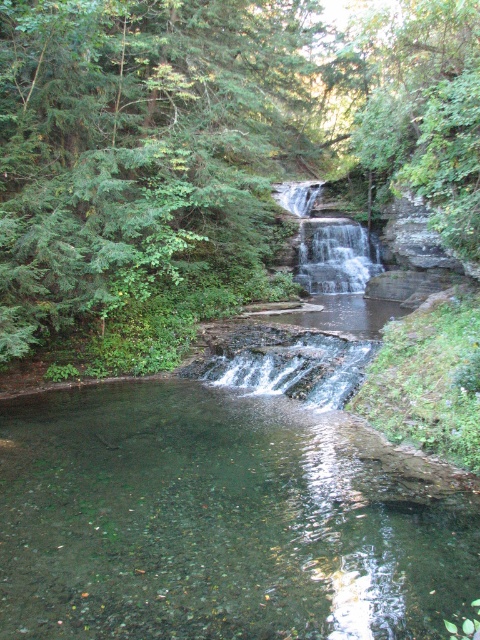
You are a hiker who wants to cross the clear water at center. There is a green leafy tree at center nearby. Can you use the tree to help you cross the water safely?

The green leafy tree at center is 15.76 feet away from the clear water at center. Since the distance is too far to jump across, you may need to find another way to cross the water safely.

You are standing at the base of the waterfall and want to reach a hidden treasure located at point (427, 172). There is a large boulder blocking your path at point (336, 595). Can you walk around the boulder to reach the treasure?

A: Point (427, 172) is behind point (336, 595), so you cannot walk around the boulder at point (336, 595) to reach the treasure because the treasure is already blocked by the boulder.

You are standing at the edge of the pool and see a point marked at coordinates (x=216, y=522). Based on the scene description, where is this point located?

The point at (x=216, y=522) is located on the clear glass stream at center.